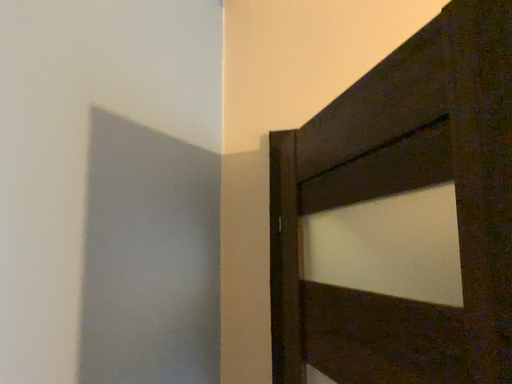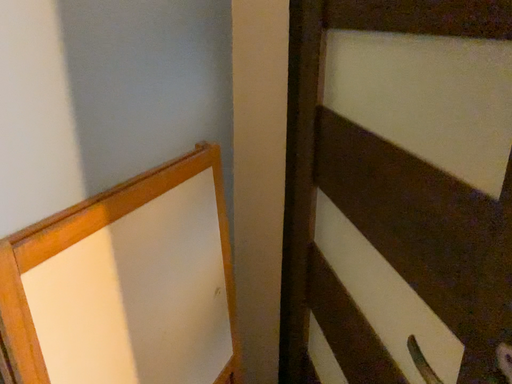
Question: Which way did the camera rotate in the video?

Choices:
 (A) rotated upward
 (B) rotated downward

Answer: (B)